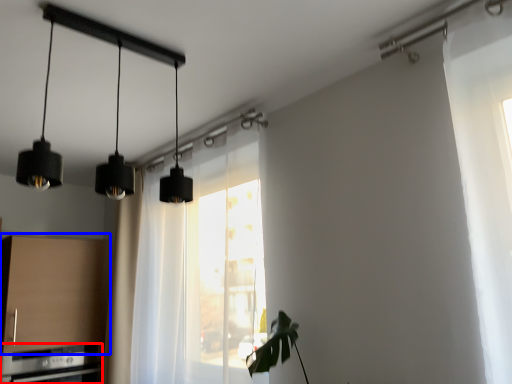
Question: Which object is closer to the camera taking this photo, appliance (highlighted by a red box) or cabinetry (highlighted by a blue box)?

Choices:
 (A) appliance
 (B) cabinetry

Answer: (A)